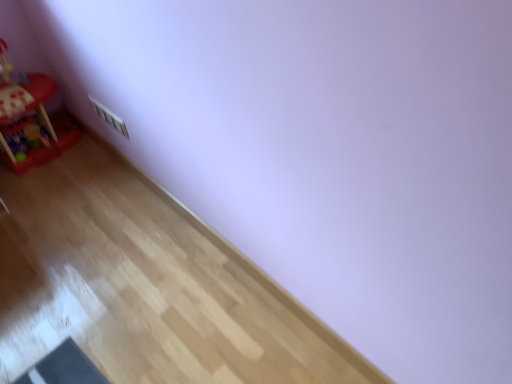
What do you see at coordinates (31, 124) in the screenshot? I see `matte plastic toy at left` at bounding box center [31, 124].

Locate an element on the screen. matte plastic toy at left is located at coordinates (31, 124).

At what (x,y) coordinates should I click in order to perform the action: click on matte plastic toy at left. Please return your answer as a coordinate pair (x, y). Image resolution: width=512 pixels, height=384 pixels. Looking at the image, I should click on (31, 124).